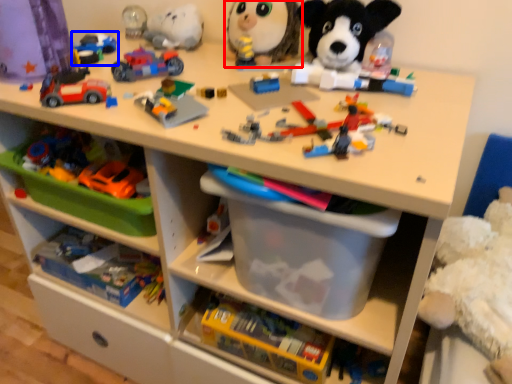
Question: Which of the following is the closest to the observer, toy (highlighted by a red box) or toy (highlighted by a blue box)?

Choices:
 (A) toy
 (B) toy

Answer: (A)